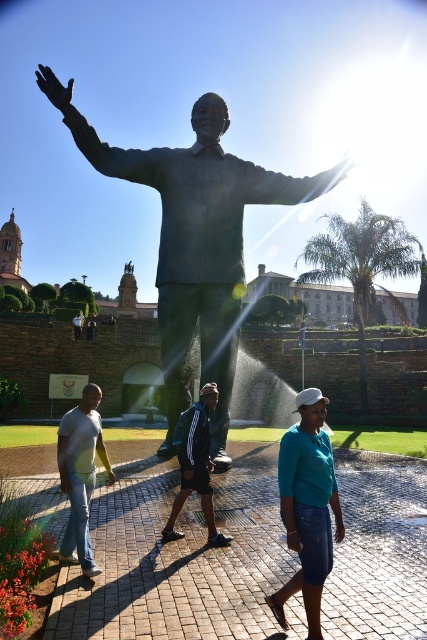
Question: From the image, what is the correct spatial relationship of bronze statue at center in relation to dark blue jacket at center?

Choices:
 (A) above
 (B) below

Answer: (A)

Question: Among these points, which one is farthest from the camera?

Choices:
 (A) (301, 438)
 (B) (181, 499)
 (C) (73, 496)

Answer: (B)

Question: Does teal matte shirt at center come in front of dark blue jacket at center?

Choices:
 (A) yes
 (B) no

Answer: (A)

Question: Is teal matte shirt at center further to camera compared to light gray t-shirt at center?

Choices:
 (A) yes
 (B) no

Answer: (B)

Question: Which point is closer to the camera taking this photo?

Choices:
 (A) (87, 572)
 (B) (190, 433)

Answer: (A)

Question: Which of these objects is positioned closest to the teal matte shirt at center?

Choices:
 (A) bronze statue at center
 (B) dark blue jacket at center

Answer: (B)